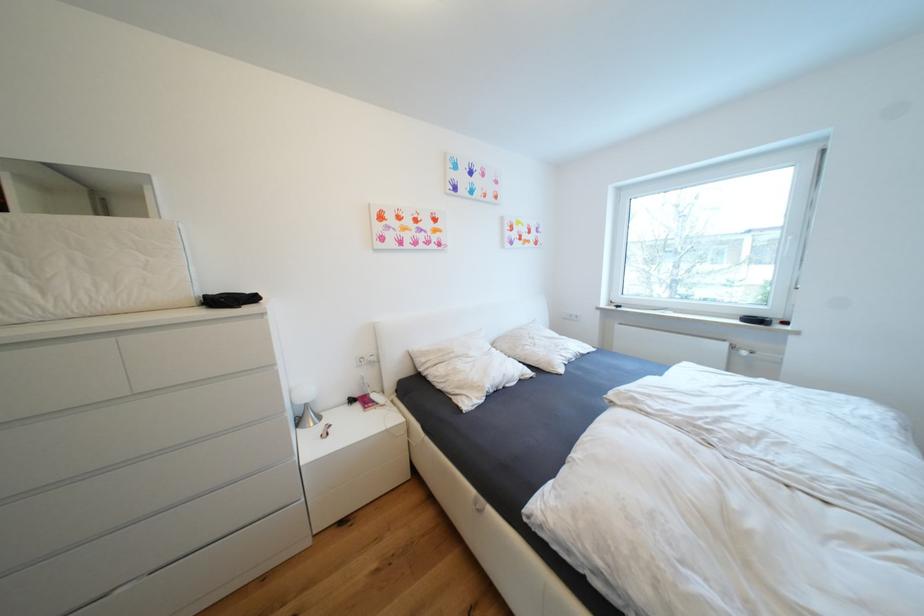
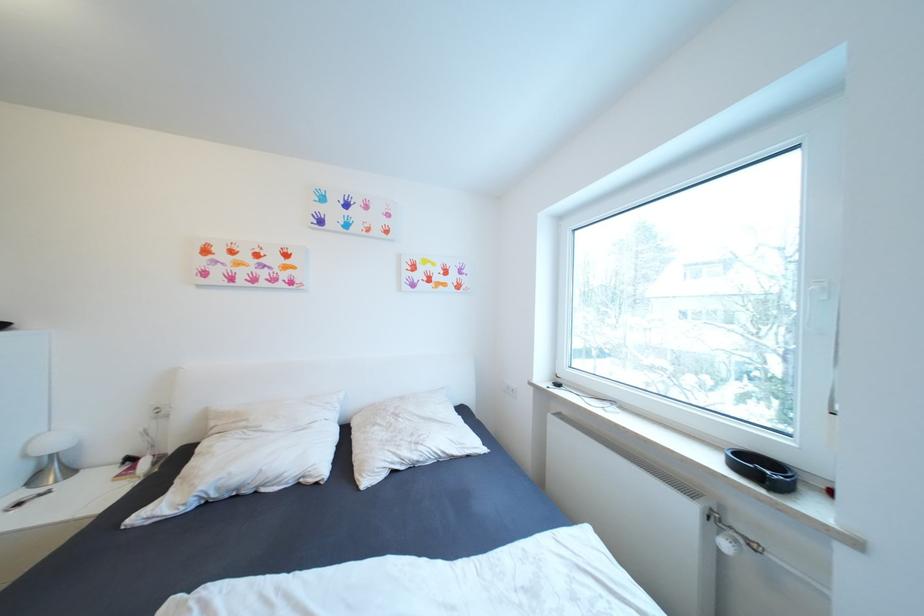
In the second image, find the point that corresponds to point 540,339 in the first image.

(405, 416)